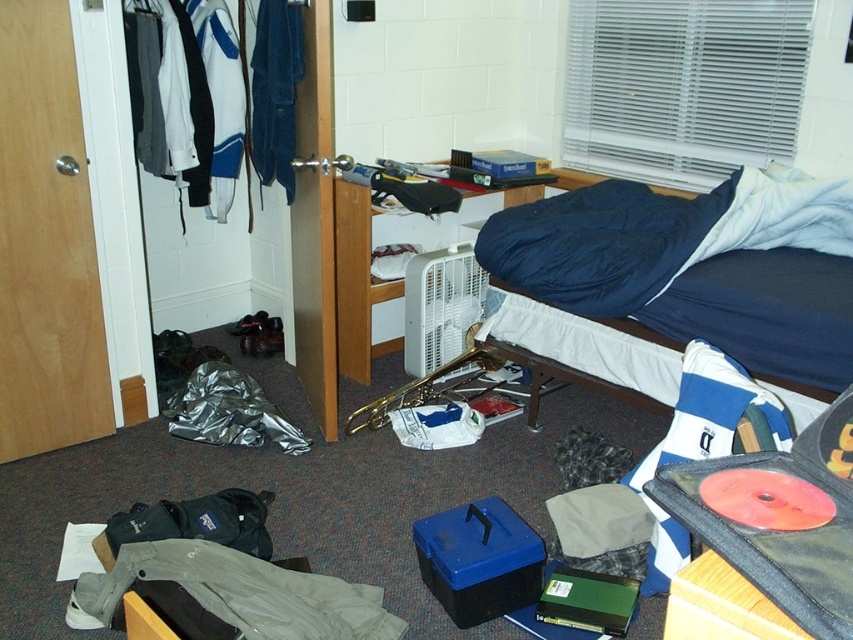
Question: Which object is farther from the camera taking this photo?

Choices:
 (A) blue fabric jacket at left
 (B) dark blue fabric bed at upper right

Answer: (A)

Question: Considering the real-world distances, which object is farthest from the dark blue fabric bed at upper right?

Choices:
 (A) white fabric clothes at left
 (B) blue fabric jacket at left
 (C) khaki cotton jacket at lower left

Answer: (C)

Question: Which point is farther to the camera?

Choices:
 (A) white fabric clothes at left
 (B) blue fabric jacket at left
 (C) khaki cotton jacket at lower left
 (D) dark blue fabric bed at upper right

Answer: (B)

Question: Is white fabric clothes at left to the left of blue fabric jacket at left from the viewer's perspective?

Choices:
 (A) yes
 (B) no

Answer: (A)

Question: Is the position of white fabric clothes at left less distant than that of khaki cotton jacket at lower left?

Choices:
 (A) no
 (B) yes

Answer: (A)

Question: Can you confirm if white fabric clothes at left is wider than khaki cotton jacket at lower left?

Choices:
 (A) no
 (B) yes

Answer: (A)